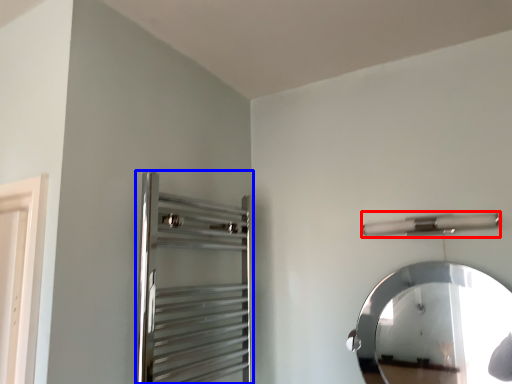
Question: Among these objects, which one is farthest to the camera, towel bar (highlighted by a red box) or screen door (highlighted by a blue box)?

Choices:
 (A) towel bar
 (B) screen door

Answer: (A)